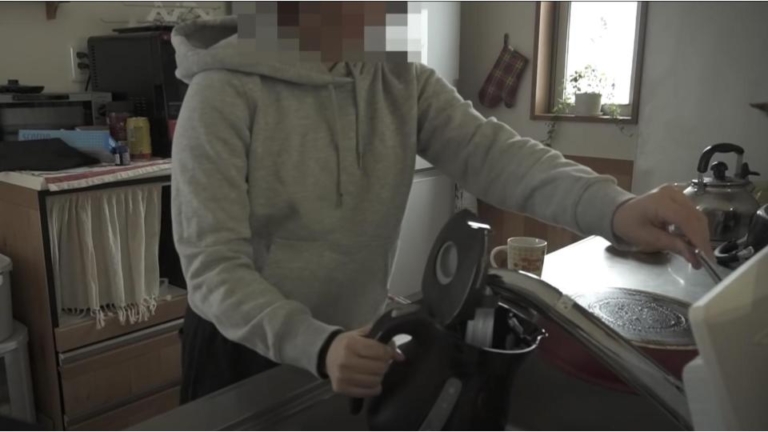
Where is `faucet`? The width and height of the screenshot is (768, 432). faucet is located at coordinates (613, 345).